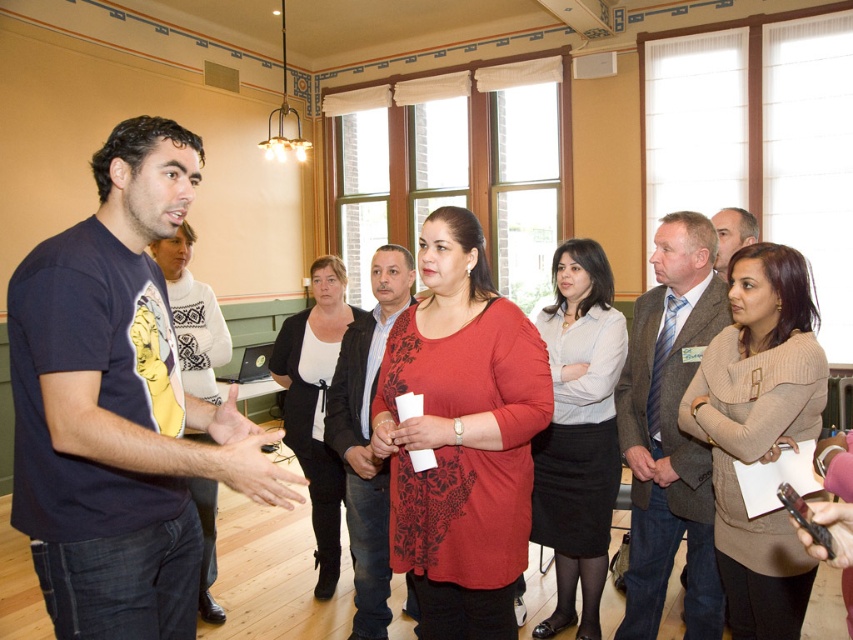
Question: In this image, where is light blue shirt at center located relative to matte black shirt at center?

Choices:
 (A) below
 (B) above

Answer: (B)

Question: Which object is positioned closest to the matte gray suit at center?

Choices:
 (A) matte black shirt at center
 (B) light blue shirt at center
 (C) matte black t-shirt at center

Answer: (B)

Question: Is matte red blouse at center closer to the viewer compared to matte gray suit at center?

Choices:
 (A) yes
 (B) no

Answer: (A)

Question: Which of the following is the farthest from the observer?

Choices:
 (A) (451, 458)
 (B) (749, 227)
 (C) (403, 285)
 (D) (561, 451)

Answer: (B)

Question: Among these objects, which one is farthest from the camera?

Choices:
 (A) matte black t-shirt at center
 (B) beige knitted sweater at center
 (C) matte red blouse at center
 (D) black matte jacket at center

Answer: (D)

Question: Does black matte jacket at center have a greater width compared to matte gray suit at center?

Choices:
 (A) no
 (B) yes

Answer: (B)